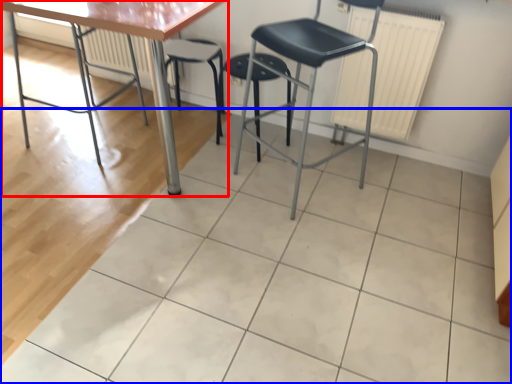
Question: Which of the following is the farthest to the observer, table (highlighted by a red box) or ceramic tile (highlighted by a blue box)?

Choices:
 (A) table
 (B) ceramic tile

Answer: (A)